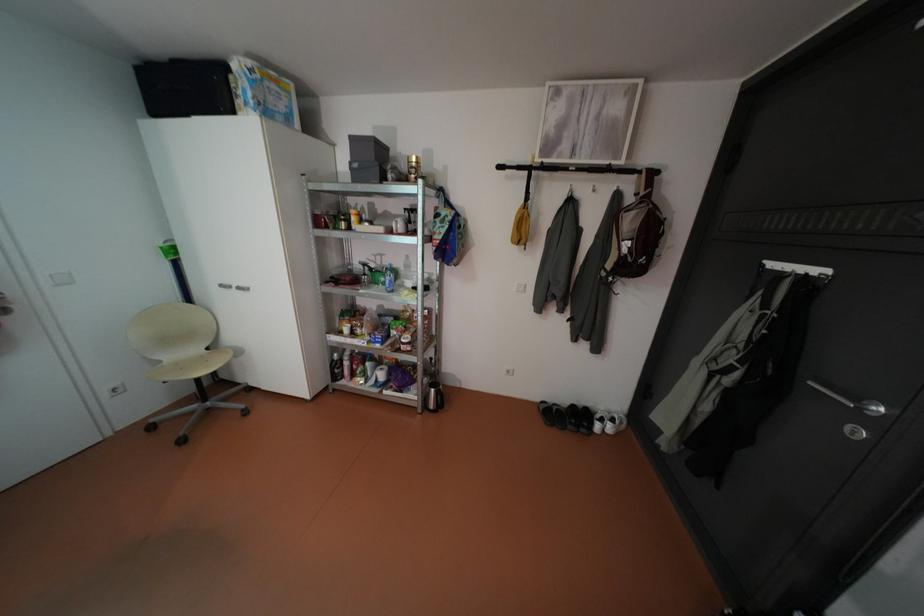
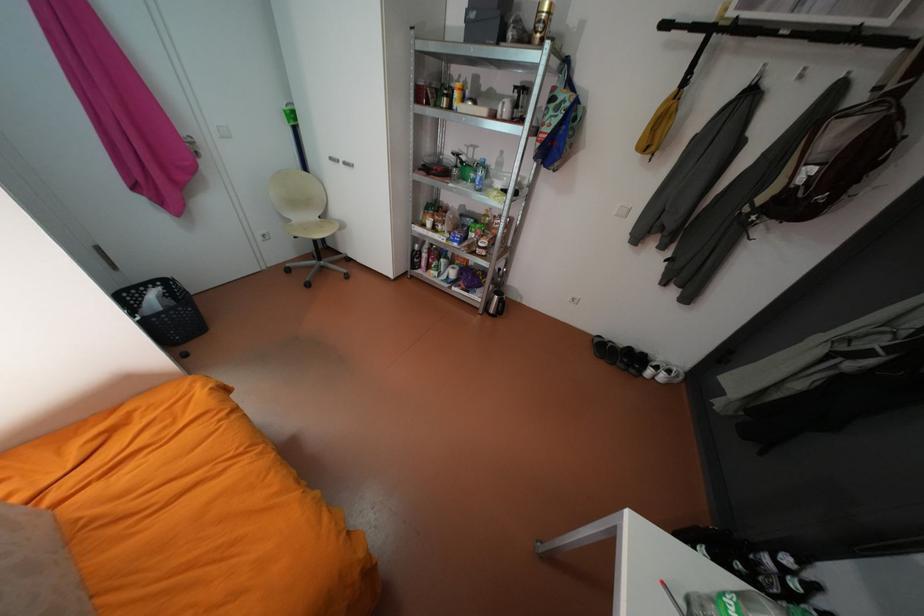
In the second image, find the point that corresponds to point (424, 408) in the first image.

(487, 308)